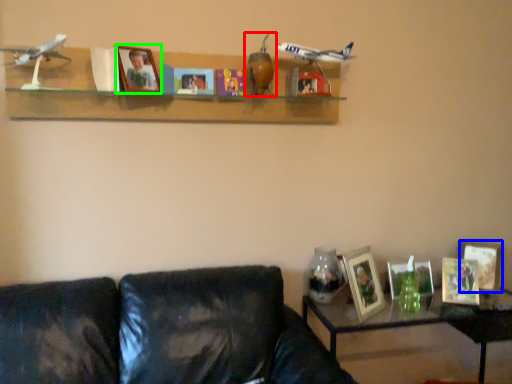
Question: Which object is positioned farthest from toy (highlighted by a red box)? Select from picture frame (highlighted by a blue box) and picture frame (highlighted by a green box).

Choices:
 (A) picture frame
 (B) picture frame

Answer: (A)